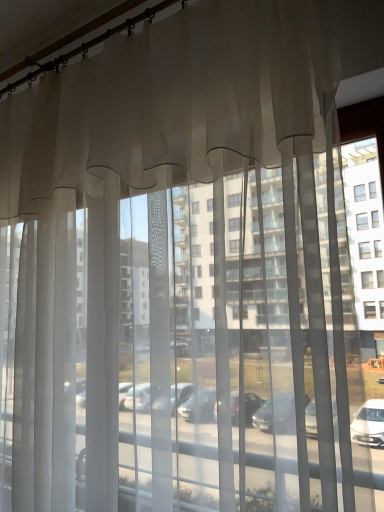
Measure the distance between point (174, 269) and camera.

The distance of point (174, 269) from camera is 3.91 feet.

What do you see at coordinates (242, 346) in the screenshot? I see `transparent sheer curtains at center` at bounding box center [242, 346].

The image size is (384, 512). I want to click on transparent sheer curtains at center, so pos(242,346).

You are a GUI agent. You are given a task and a screenshot of the screen. Output one action in this format:
    pyautogui.click(x=<x>, y=<y>)
    Task: Click on the transparent sheer curtains at center
    This screenshot has width=384, height=512.
    Given the screenshot: What is the action you would take?
    pyautogui.click(x=242, y=346)